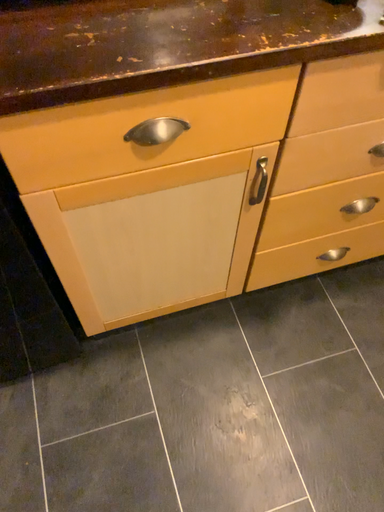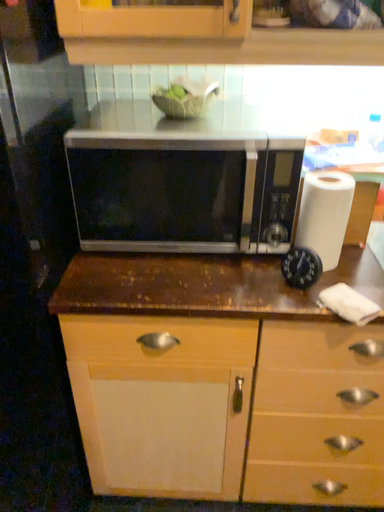
Question: How did the camera likely rotate when shooting the video?

Choices:
 (A) rotated upward
 (B) rotated downward

Answer: (A)